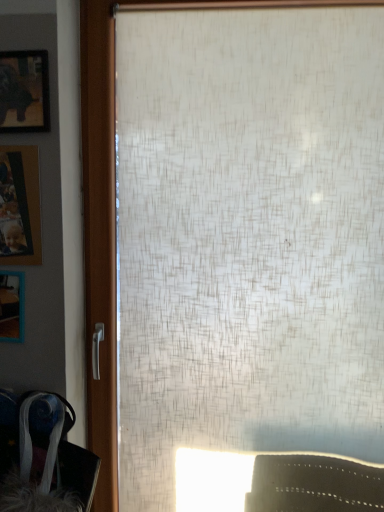
Question: From the image's perspective, is wooden photo frame at left, which is the second picture frame in bottom-to-top order, over wooden frame at left, which is counted as the 1th picture frame, starting from the bottom?

Choices:
 (A) no
 (B) yes

Answer: (B)

Question: Is wooden photo frame at left, which is the second picture frame in bottom-to-top order, to the right of wooden frame at left, which is counted as the 1th picture frame, starting from the bottom, from the viewer's perspective?

Choices:
 (A) no
 (B) yes

Answer: (B)

Question: Is wooden photo frame at left, which is the second picture frame in bottom-to-top order, shorter than wooden frame at left, which is counted as the 1th picture frame, starting from the bottom?

Choices:
 (A) yes
 (B) no

Answer: (B)

Question: Does wooden photo frame at left, placed as the 2th picture frame when sorted from top to bottom, come behind wooden frame at left, which is counted as the 1th picture frame, starting from the bottom?

Choices:
 (A) yes
 (B) no

Answer: (B)

Question: Considering the relative sizes of wooden photo frame at left, which is the second picture frame in bottom-to-top order, and wooden frame at left, positioned as the third picture frame in top-to-bottom order, in the image provided, is wooden photo frame at left, which is the second picture frame in bottom-to-top order, taller than wooden frame at left, positioned as the third picture frame in top-to-bottom order,?

Choices:
 (A) no
 (B) yes

Answer: (B)

Question: Is wooden photo frame at left, placed as the 2th picture frame when sorted from top to bottom, positioned with its back to wooden frame at left, which is counted as the 1th picture frame, starting from the bottom?

Choices:
 (A) no
 (B) yes

Answer: (A)

Question: Is the position of wooden frame at left, which is counted as the 1th picture frame, starting from the bottom, less distant than that of matte black picture frame at upper left, positioned as the third picture frame in bottom-to-top order?

Choices:
 (A) yes
 (B) no

Answer: (B)

Question: Considering the relative sizes of wooden frame at left, which is counted as the 1th picture frame, starting from the bottom, and matte black picture frame at upper left, positioned as the third picture frame in bottom-to-top order, in the image provided, is wooden frame at left, which is counted as the 1th picture frame, starting from the bottom, thinner than matte black picture frame at upper left, positioned as the third picture frame in bottom-to-top order,?

Choices:
 (A) yes
 (B) no

Answer: (B)

Question: Is wooden frame at left, which is counted as the 1th picture frame, starting from the bottom, far from matte black picture frame at upper left, which ranks as the 1th picture frame in top-to-bottom order?

Choices:
 (A) yes
 (B) no

Answer: (B)

Question: Is wooden frame at left, which is counted as the 1th picture frame, starting from the bottom, next to matte black picture frame at upper left, which ranks as the 1th picture frame in top-to-bottom order?

Choices:
 (A) no
 (B) yes

Answer: (A)

Question: Does wooden frame at left, which is counted as the 1th picture frame, starting from the bottom, lie behind matte black picture frame at upper left, positioned as the third picture frame in bottom-to-top order?

Choices:
 (A) no
 (B) yes

Answer: (B)

Question: Is wooden frame at left, which is counted as the 1th picture frame, starting from the bottom, to the left of matte black picture frame at upper left, which ranks as the 1th picture frame in top-to-bottom order, from the viewer's perspective?

Choices:
 (A) no
 (B) yes

Answer: (B)

Question: Does velvet-like fabric swivel chair at lower left touch wooden photo frame at left, placed as the 2th picture frame when sorted from top to bottom?

Choices:
 (A) yes
 (B) no

Answer: (B)